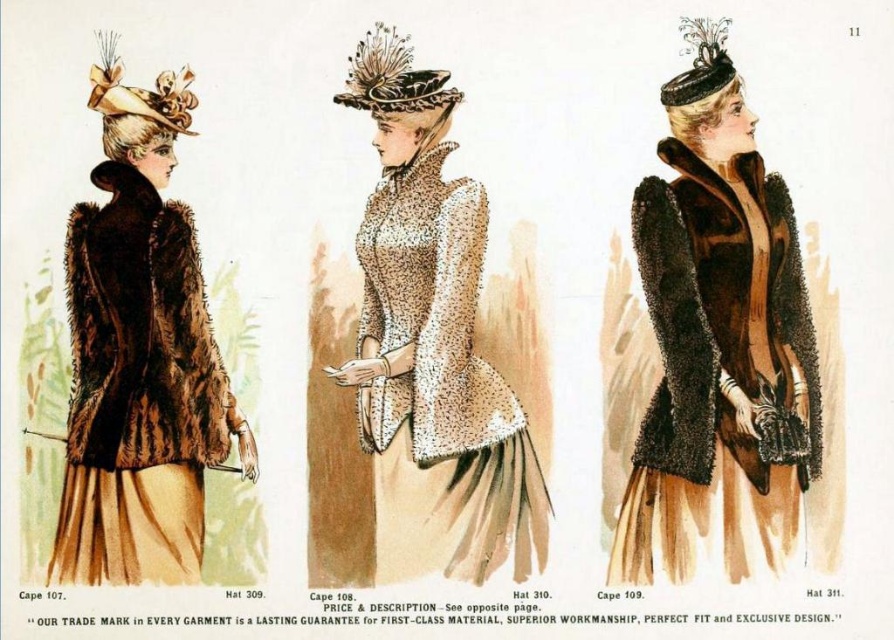
Is the position of brown fur cape at left more distant than that of shiny black fabric hat at center?

No, it is not.

Can you confirm if brown fur cape at left is bigger than shiny black fabric hat at center?

Yes, brown fur cape at left is bigger than shiny black fabric hat at center.

Does point (85, 531) lie in front of point (344, 96)?

Yes.

Find the location of a particular element. brown fur cape at left is located at coordinates (139, 355).

Does point (481, 506) lie in front of point (204, 460)?

Yes, it is in front of point (204, 460).

Can you confirm if speckled woolen dress at center is positioned below brown fur coat at left?

Actually, speckled woolen dress at center is above brown fur coat at left.

Between point (436, 397) and point (184, 204), which one is positioned behind?

The point (184, 204) is behind.

Locate an element on the screen. speckled woolen dress at center is located at coordinates (431, 348).

Is brown fur coat at left to the left of black velvet hat at upper center from the viewer's perspective?

Yes, brown fur coat at left is to the left of black velvet hat at upper center.

Does brown fur coat at left have a lesser height compared to black velvet hat at upper center?

Incorrect, brown fur coat at left's height does not fall short of black velvet hat at upper center's.

Who is more forward, (98,394) or (698,49)?

Point (98,394) is in front.

The width and height of the screenshot is (894, 640). What are the coordinates of `brown fur coat at left` in the screenshot? It's located at (140, 333).